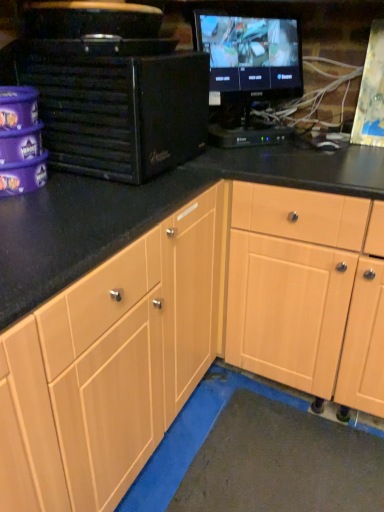
Question: Are black matte desktop computer at left and black glossy monitor at upper right located far from each other?

Choices:
 (A) yes
 (B) no

Answer: (B)

Question: Is black matte desktop computer at left to the right of black glossy monitor at upper right from the viewer's perspective?

Choices:
 (A) no
 (B) yes

Answer: (A)

Question: Can you confirm if black matte desktop computer at left is wider than black glossy monitor at upper right?

Choices:
 (A) yes
 (B) no

Answer: (A)

Question: Can you confirm if black matte desktop computer at left is thinner than black glossy monitor at upper right?

Choices:
 (A) no
 (B) yes

Answer: (A)

Question: Does black matte desktop computer at left have a lesser height compared to black glossy monitor at upper right?

Choices:
 (A) no
 (B) yes

Answer: (B)

Question: Is light wood cabinet at center wider or thinner than black glossy monitor at upper right?

Choices:
 (A) wide
 (B) thin

Answer: (A)

Question: Based on their sizes in the image, would you say light wood cabinet at center is bigger or smaller than black glossy monitor at upper right?

Choices:
 (A) small
 (B) big

Answer: (B)

Question: Is point (273, 321) positioned closer to the camera than point (200, 18)?

Choices:
 (A) farther
 (B) closer

Answer: (A)

Question: Is light wood cabinet at center to the left or to the right of black glossy monitor at upper right in the image?

Choices:
 (A) right
 (B) left

Answer: (A)

Question: Considering the positions of black matte desktop computer at left and light wood cabinet at center in the image, is black matte desktop computer at left taller or shorter than light wood cabinet at center?

Choices:
 (A) tall
 (B) short

Answer: (B)

Question: Is point (x=100, y=158) positioned closer to the camera than point (x=274, y=366)?

Choices:
 (A) farther
 (B) closer

Answer: (B)

Question: From a real-world perspective, is black matte desktop computer at left positioned above or below light wood cabinet at center?

Choices:
 (A) above
 (B) below

Answer: (A)

Question: Would you say black matte desktop computer at left is inside or outside light wood cabinet at center?

Choices:
 (A) outside
 (B) inside

Answer: (A)

Question: In terms of width, does black matte desktop computer at left look wider or thinner when compared to black glossy monitor at upper right?

Choices:
 (A) thin
 (B) wide

Answer: (B)

Question: From the image's perspective, is black matte desktop computer at left above or below black glossy monitor at upper right?

Choices:
 (A) below
 (B) above

Answer: (A)